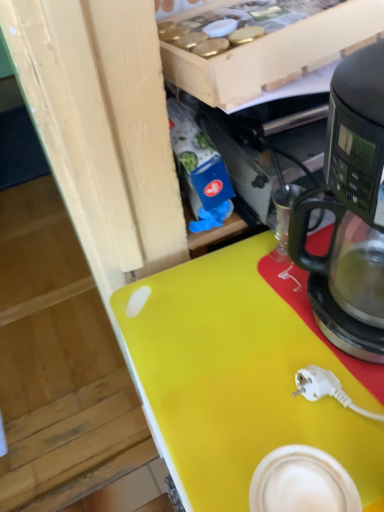
Question: Is point (297, 409) closer or farther from the camera than point (329, 282)?

Choices:
 (A) closer
 (B) farther

Answer: (A)

Question: Is yellow matte desk at center bigger or smaller than black matte coffee maker at right?

Choices:
 (A) big
 (B) small

Answer: (A)

Question: Is yellow matte desk at center in front of or behind black matte coffee maker at right in the image?

Choices:
 (A) front
 (B) behind

Answer: (B)

Question: Is point (332, 334) closer or farther from the camera than point (153, 367)?

Choices:
 (A) farther
 (B) closer

Answer: (B)

Question: Relative to yellow matte desk at center, is black matte coffee maker at right in front or behind?

Choices:
 (A) front
 (B) behind

Answer: (A)

Question: From a real-world perspective, is black matte coffee maker at right physically located above or below yellow matte desk at center?

Choices:
 (A) above
 (B) below

Answer: (A)

Question: From the image's perspective, is black matte coffee maker at right positioned above or below yellow matte desk at center?

Choices:
 (A) below
 (B) above

Answer: (B)